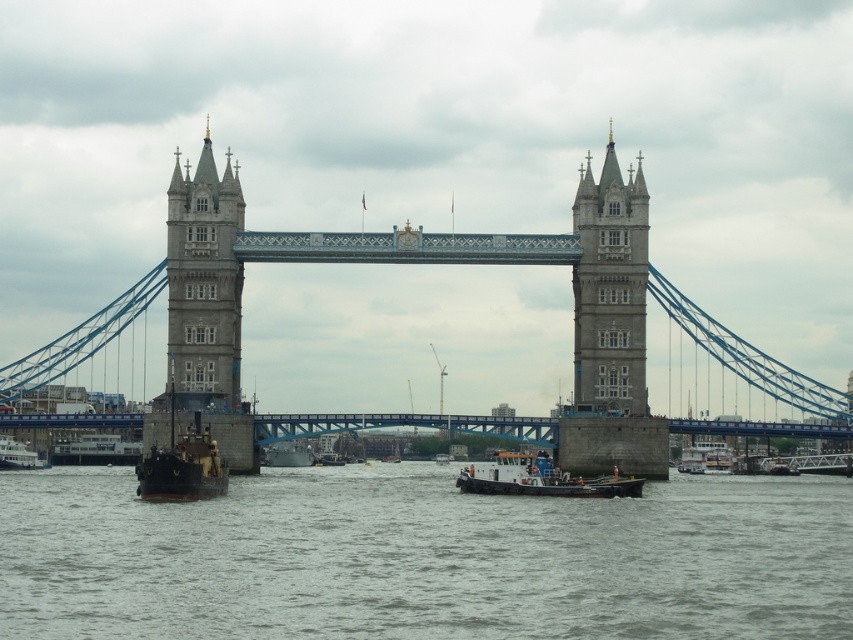
Based on the photo, which of these two, stone bridge at center or metallic gray boat at center, stands taller?

stone bridge at center

Is the position of stone bridge at center less distant than that of metallic gray boat at center?

Yes.

The height and width of the screenshot is (640, 853). What do you see at coordinates (409, 262) in the screenshot? I see `stone bridge at center` at bounding box center [409, 262].

You are a GUI agent. You are given a task and a screenshot of the screen. Output one action in this format:
    pyautogui.click(x=<x>, y=<y>)
    Task: Click on the stone bridge at center
    This screenshot has height=640, width=853.
    Given the screenshot: What is the action you would take?
    pyautogui.click(x=409, y=262)

Is point (548, 476) farther from camera compared to point (289, 458)?

That is False.

Identify the location of white plastic boat at center. (538, 477).

Where is `white plastic boat at center`? white plastic boat at center is located at coordinates (538, 477).

Consider the image. Is gray stone tower at center to the right of metallic gray boat at lower left from the viewer's perspective?

Indeed, gray stone tower at center is positioned on the right side of metallic gray boat at lower left.

Who is lower down, gray stone tower at center or metallic gray boat at lower left?

metallic gray boat at lower left is below.

Which is behind, point (618, 330) or point (22, 449)?

The point (22, 449) is more distant.

What are the coordinates of `gray stone tower at center` in the screenshot? It's located at (610, 289).